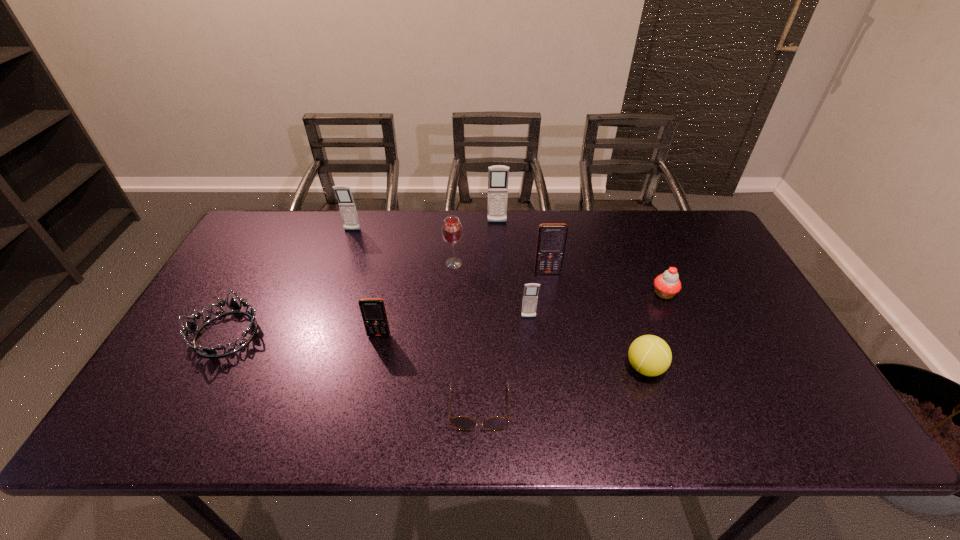
Where is `free region at the far edge`? free region at the far edge is located at coordinates (407, 223).

Identify the location of vacant space at the near edge. (250, 415).

Identify the location of free space at the left edge of the desktop. The image size is (960, 540). (220, 317).

Locate an element on the screen. This screenshot has height=540, width=960. vacant space at the right edge of the desktop is located at coordinates (x=797, y=389).

Locate an element on the screen. The image size is (960, 540). free spot at the near left corner of the desktop is located at coordinates (144, 435).

This screenshot has width=960, height=540. Find the location of `vacant space at the far right corner of the desktop`. vacant space at the far right corner of the desktop is located at coordinates (701, 235).

The height and width of the screenshot is (540, 960). Identify the location of vacant space that is in between the fourth object from right to left and the leftmost cellular telephone. (441, 274).

You are a GUI agent. You are given a task and a screenshot of the screen. Output one action in this format:
    pyautogui.click(x=<x>, y=<y>)
    Task: Click on the free space between the fourth nearest cellular telephone and the rightmost cellular telephone
    This screenshot has height=540, width=960.
    Given the screenshot: What is the action you would take?
    pyautogui.click(x=449, y=252)

Find the location of `free space between the shortest object and the nearest gray cellular telephone`. free space between the shortest object and the nearest gray cellular telephone is located at coordinates (504, 362).

Locate an element on the screen. Image resolution: width=960 pixels, height=540 pixels. vacant area between the right orange cellular telephone and the ninth object from left to right is located at coordinates (596, 320).